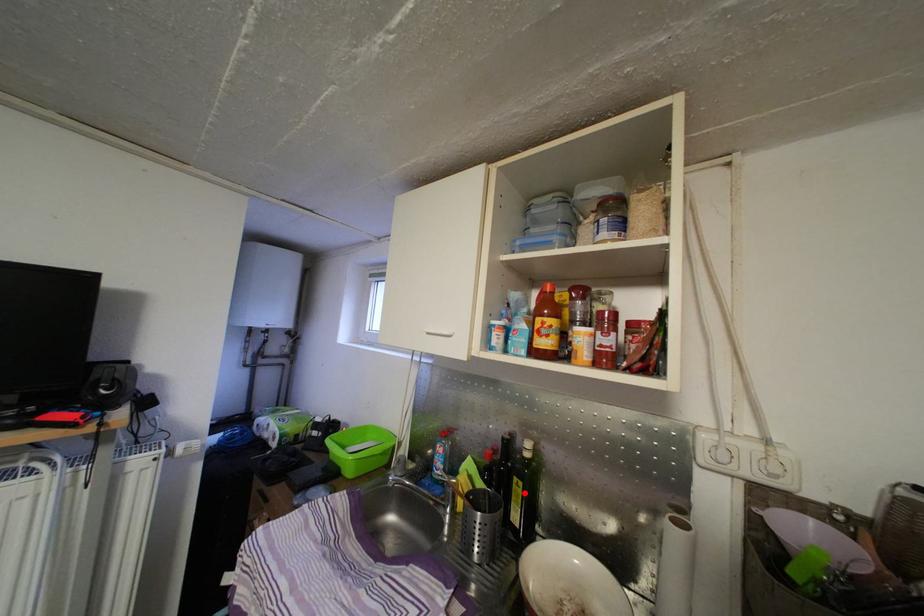
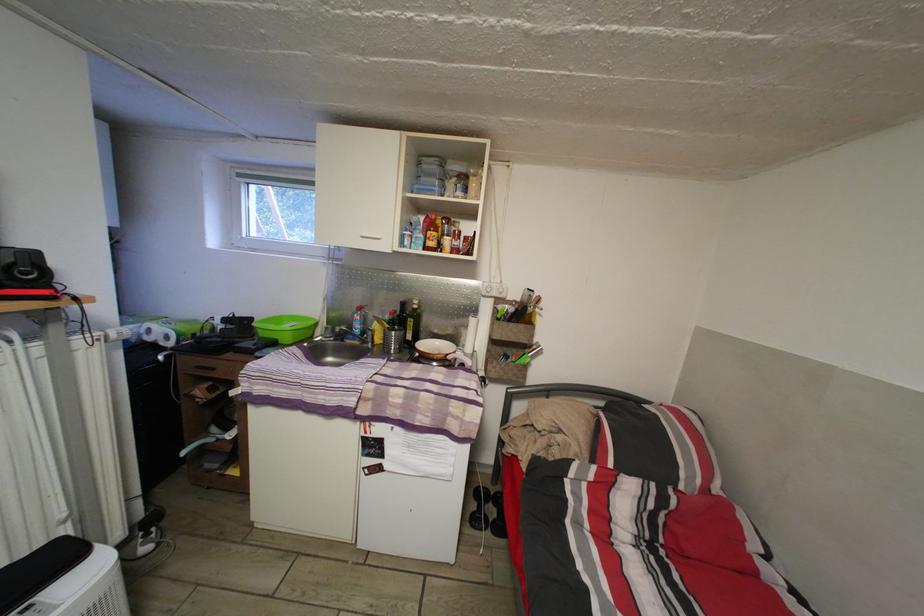
Question: I am providing you with two images of the same scene from different viewpoints. A red point is shown in image1. For the corresponding object point in image2, is it positioned nearer or farther from the camera?

Choices:
 (A) Nearer
 (B) Farther

Answer: (A)